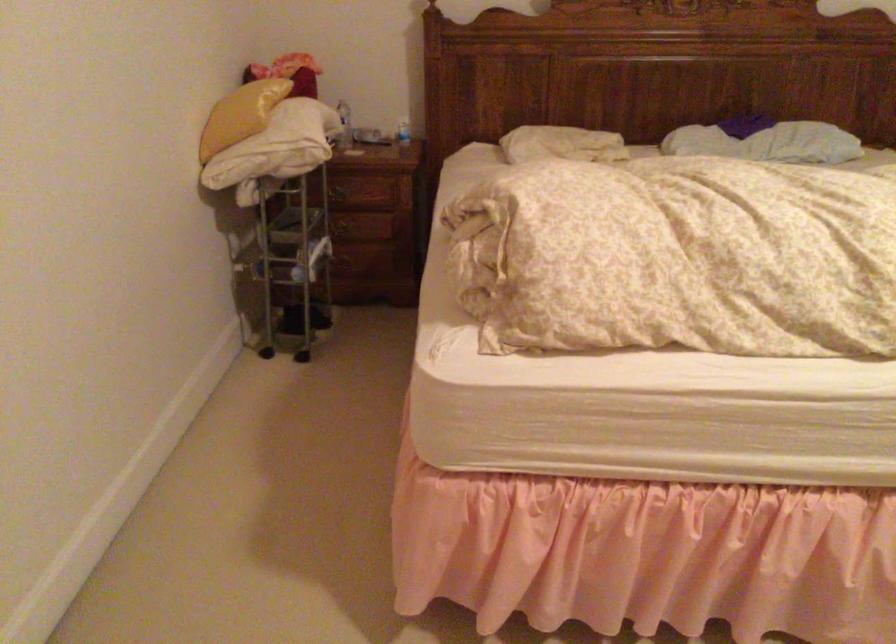
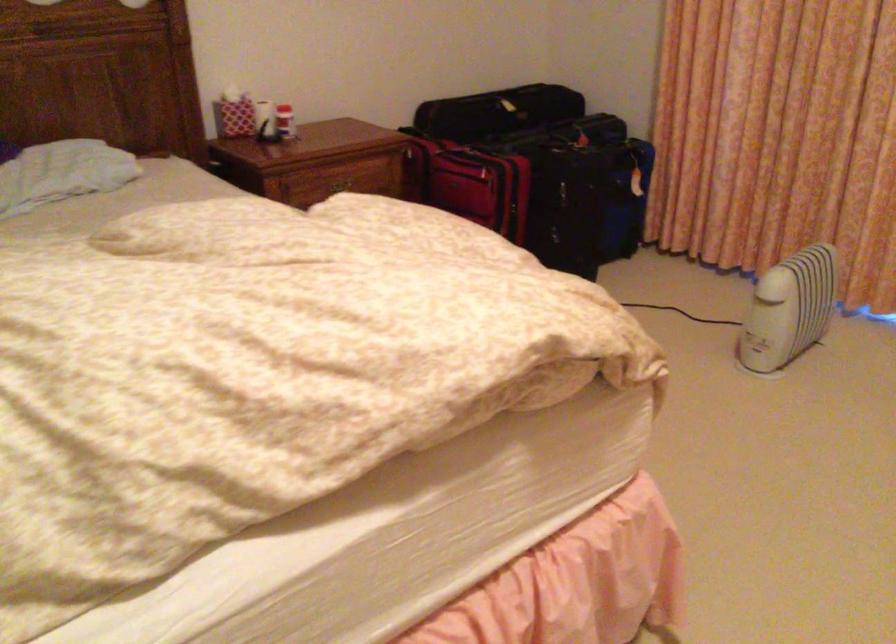
Question: Based on the continuous images, in which direction is the camera rotating? Reply with the corresponding letter.

Choices:
 (A) Left
 (B) Right
 (C) Up
 (D) Down

Answer: (B)